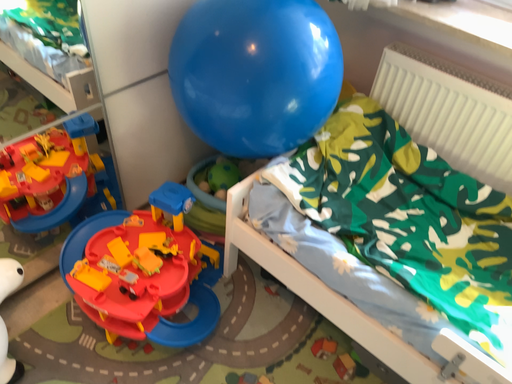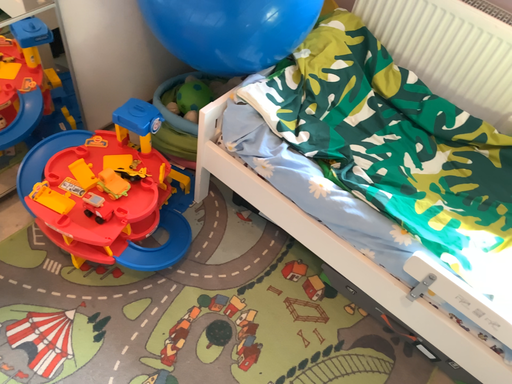
Question: Which way did the camera rotate in the video?

Choices:
 (A) rotated downward
 (B) rotated upward

Answer: (A)